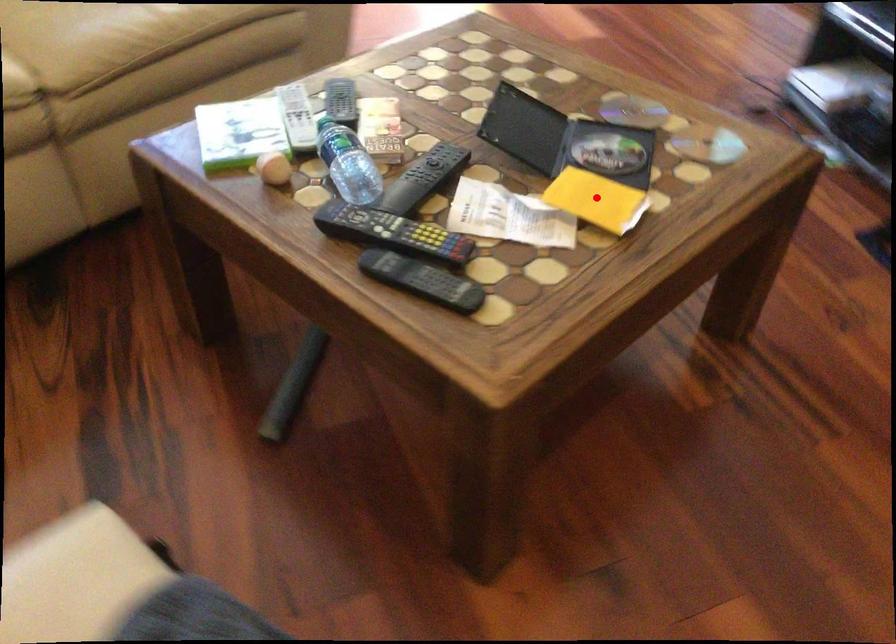
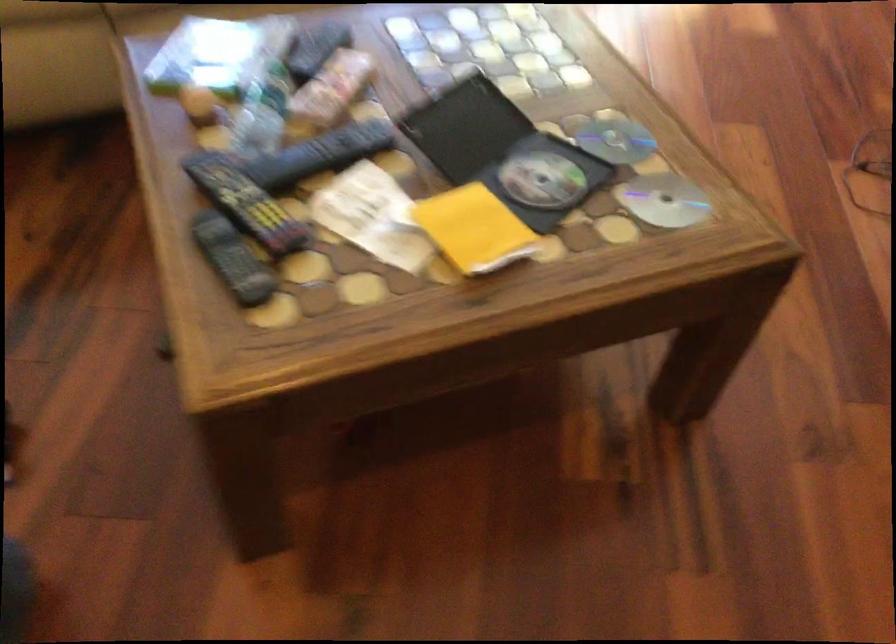
Find the pixel in the second image that matches the highlighted location in the first image.

(474, 229)